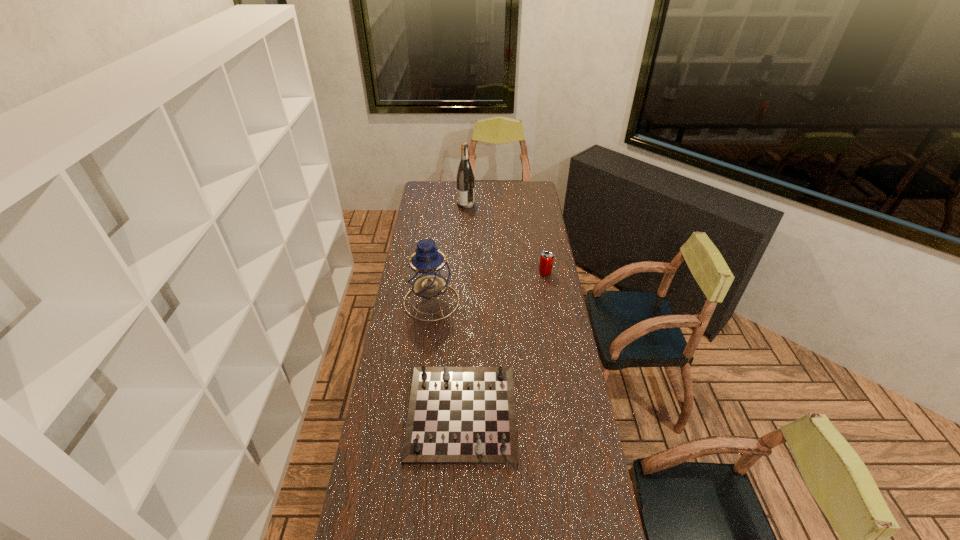
Where is `object that is at the far edge`? The width and height of the screenshot is (960, 540). object that is at the far edge is located at coordinates (465, 178).

Image resolution: width=960 pixels, height=540 pixels. I want to click on lantern that is at the left edge, so click(x=428, y=273).

Identify the location of chessboard that is at the left edge. (457, 415).

You are a GUI agent. You are given a task and a screenshot of the screen. Output one action in this format:
    pyautogui.click(x=<x>, y=<y>)
    Task: Click on the object that is at the right edge
    
    Given the screenshot: What is the action you would take?
    pyautogui.click(x=546, y=258)

What are the coordinates of `vacant space at the left edge of the desktop` in the screenshot? It's located at (385, 458).

Find the location of a particular element. Image resolution: width=960 pixels, height=540 pixels. vacant region at the right edge of the desktop is located at coordinates (523, 219).

Image resolution: width=960 pixels, height=540 pixels. In order to click on vacant space at the far left corner of the desktop in this screenshot , I will do `click(426, 184)`.

Where is `free space between the second nearest object and the third nearest object`? The width and height of the screenshot is (960, 540). free space between the second nearest object and the third nearest object is located at coordinates (489, 287).

I want to click on vacant space in between the wine bottle and the rightmost object, so click(x=506, y=239).

The image size is (960, 540). Find the location of `unoccupied position between the soda can and the lantern`. unoccupied position between the soda can and the lantern is located at coordinates pos(489,287).